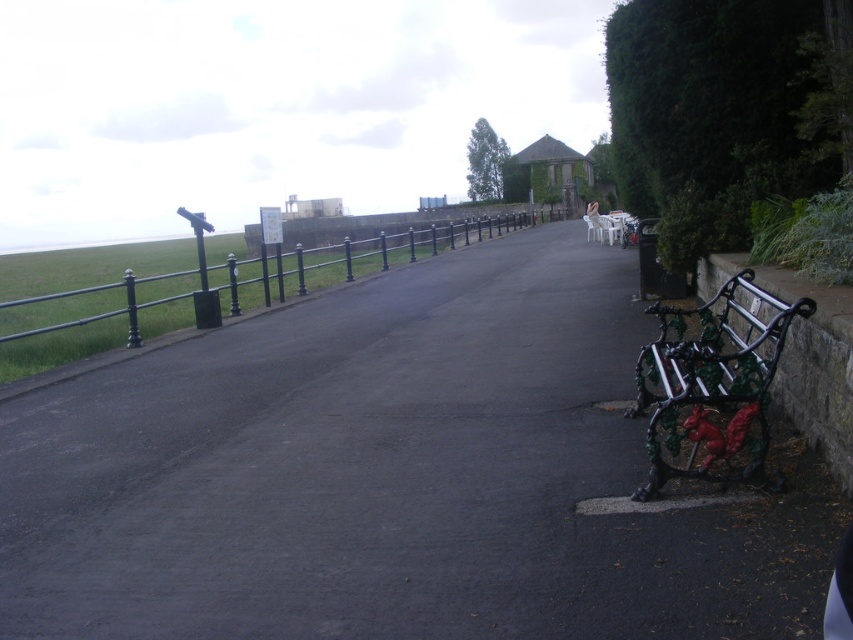
Is black asphalt pavement at center shorter than black wrought iron bench at lower right?

No.

Image resolution: width=853 pixels, height=640 pixels. What do you see at coordinates (387, 477) in the screenshot? I see `black asphalt pavement at center` at bounding box center [387, 477].

Where is `black asphalt pavement at center`? black asphalt pavement at center is located at coordinates (387, 477).

Is point (221, 481) positioned before point (94, 339)?

Yes, it is in front of point (94, 339).

Does black asphalt pavement at center appear on the right side of black metal fence at left?

Correct, you'll find black asphalt pavement at center to the right of black metal fence at left.

Where is `black asphalt pavement at center`? black asphalt pavement at center is located at coordinates (387, 477).

At what (x,y) coordinates should I click in order to perform the action: click on black asphalt pavement at center. Please return your answer as a coordinate pair (x, y). Looking at the image, I should click on (387, 477).

Measure the distance between point (737, 397) and camera.

Point (737, 397) is 4.51 meters away from camera.

Measure the distance between black wrought iron bench at lower right and camera.

A distance of 4.28 meters exists between black wrought iron bench at lower right and camera.

Does point (709, 339) come in front of point (289, 296)?

Yes, point (709, 339) is in front of point (289, 296).

This screenshot has width=853, height=640. Find the location of `black wrought iron bench at lower right`. black wrought iron bench at lower right is located at coordinates (712, 385).